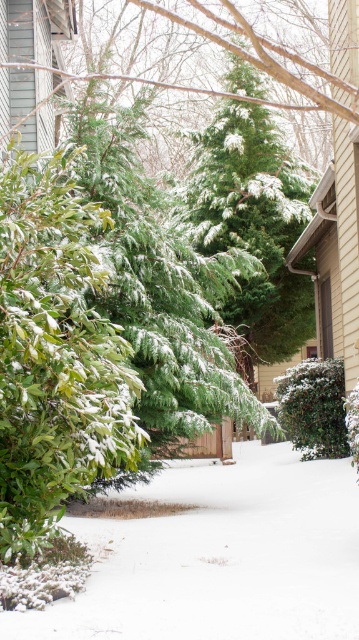
Is the position of green matte bush at center-left more distant than that of green matte bush at center?

No, it is not.

Is green matte bush at center-left thinner than green matte bush at center?

No, green matte bush at center-left is not thinner than green matte bush at center.

Is point (22, 289) in front of point (338, 436)?

Yes, point (22, 289) is in front of point (338, 436).

Where is `green matte bush at center-left`? Image resolution: width=359 pixels, height=640 pixels. green matte bush at center-left is located at coordinates 56,353.

Can you confirm if green matte evergreen tree at center is taller than green matte bush at center?

Yes.

Consider the image. Is the position of green matte evergreen tree at center less distant than that of green matte bush at center?

That is False.

Locate an element on the screen. The width and height of the screenshot is (359, 640). green matte evergreen tree at center is located at coordinates (253, 224).

Based on the photo, is white fluffy snow at center smaller than green matte bush at center?

Incorrect, white fluffy snow at center is not smaller in size than green matte bush at center.

Is white fluffy snow at center thinner than green matte bush at center?

No, white fluffy snow at center is not thinner than green matte bush at center.

Locate an element on the screen. The image size is (359, 640). white fluffy snow at center is located at coordinates click(220, 556).

I want to click on white fluffy snow at center, so click(x=220, y=556).